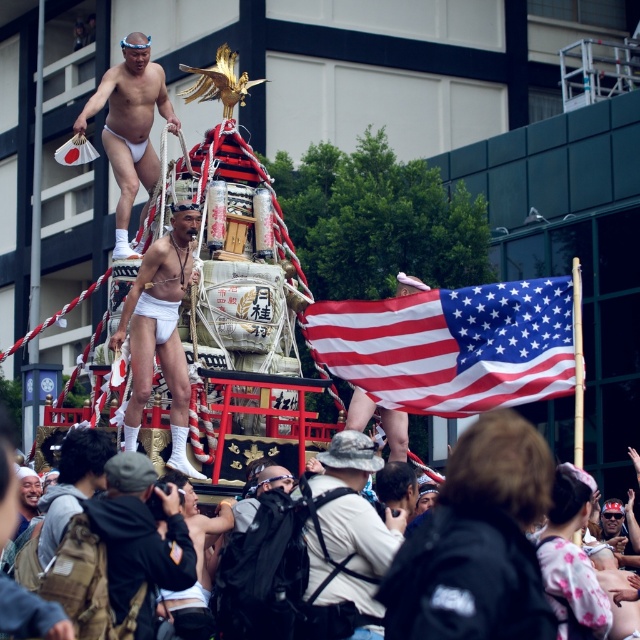
Looking at this image, does american flag at right have a greater width compared to black leather jacket at lower center?

No, american flag at right is not wider than black leather jacket at lower center.

Between point (572, 336) and point (483, 570), which one is positioned behind?

Point (572, 336)

At what (x,y) coordinates should I click in order to perform the action: click on american flag at right. Please return your answer as a coordinate pair (x, y). This screenshot has width=640, height=640. Looking at the image, I should click on (452, 346).

This screenshot has height=640, width=640. What do you see at coordinates (161, 332) in the screenshot?
I see `white matte underwear at center` at bounding box center [161, 332].

Is white matte underwear at center positioned in front of black leather jacket at lower center?

That is False.

Between point (170, 412) and point (1, 476), which one is positioned behind?

The point (170, 412) is behind.

Identify the location of white matte underwear at center. (161, 332).

Can you confirm if american flag at right is positioned below white matte underwear at upper center?

Yes.

Who is lower down, american flag at right or white matte underwear at upper center?

american flag at right

Locate an element on the screen. The width and height of the screenshot is (640, 640). american flag at right is located at coordinates (452, 346).